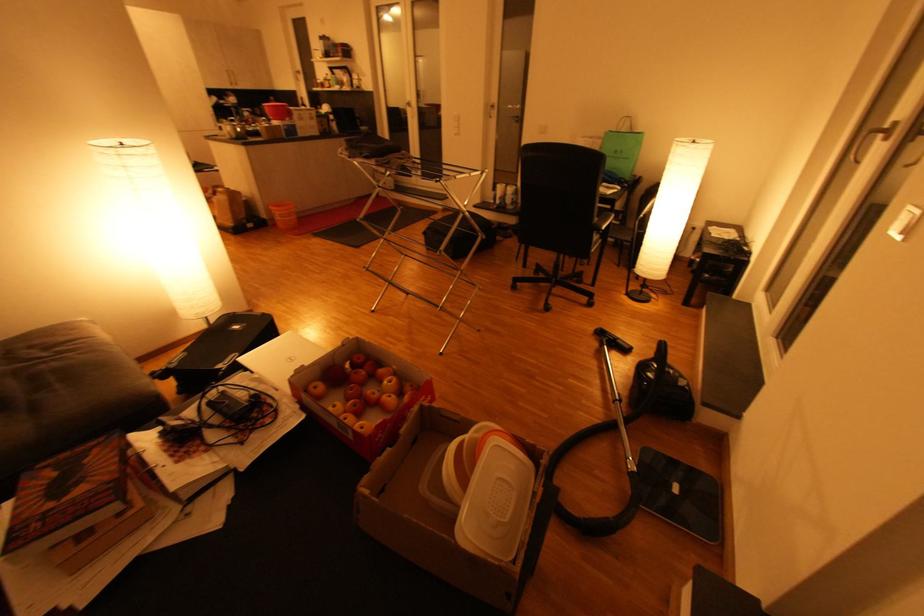
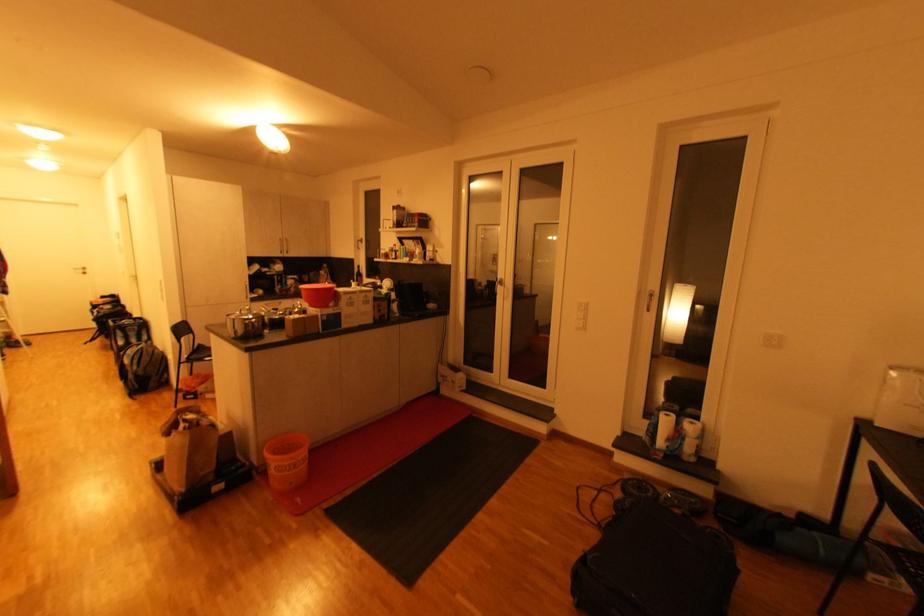
Locate, in the second image, the point that corresponds to point (273, 211) in the first image.

(265, 455)